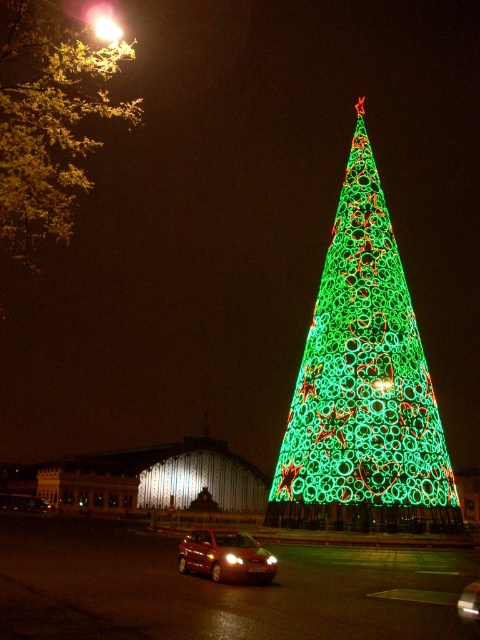
Question: Is green illuminated christmas tree at center smaller than shiny metallic car at center?

Choices:
 (A) no
 (B) yes

Answer: (A)

Question: Considering the real-world distances, which object is closest to the shiny metallic car at center?

Choices:
 (A) green illuminated christmas tree at center
 (B) green illuminated tree at upper center
 (C) matte red car at lower center

Answer: (C)

Question: Among these points, which one is nearest to the camera?

Choices:
 (A) (472, 589)
 (B) (189, 568)
 (C) (300, 508)
 (D) (32, 240)

Answer: (A)

Question: Which point is closer to the camera?

Choices:
 (A) matte red car at lower center
 (B) green illuminated tree at upper center
 (C) green illuminated christmas tree at center

Answer: (A)

Question: Is green illuminated christmas tree at center closer to the viewer compared to green illuminated tree at upper center?

Choices:
 (A) yes
 (B) no

Answer: (A)

Question: Is green illuminated christmas tree at center wider than matte red car at lower center?

Choices:
 (A) no
 (B) yes

Answer: (B)